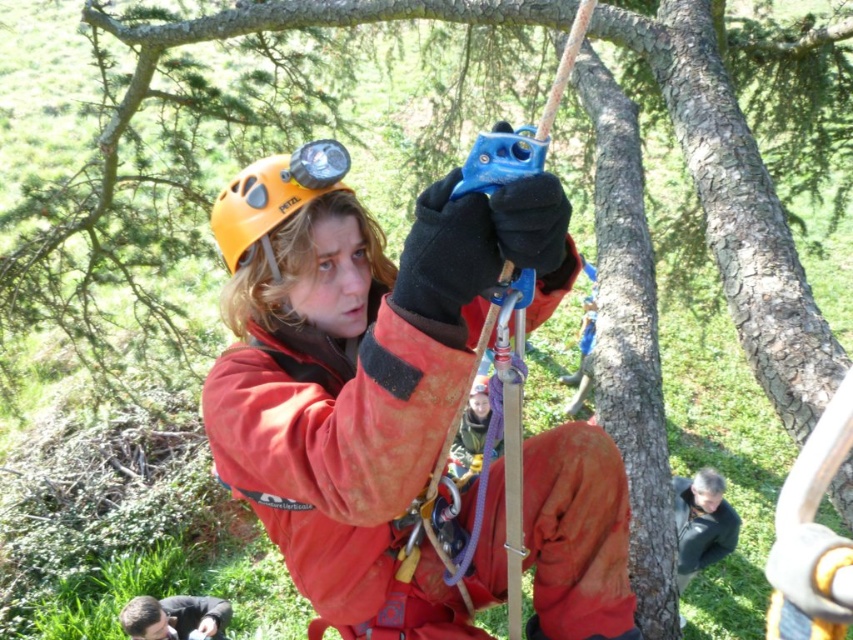
Question: Can you confirm if matte orange jacket at center is wider than dark green fabric at lower right?

Choices:
 (A) no
 (B) yes

Answer: (B)

Question: From the image, what is the correct spatial relationship of matte orange jacket at center in relation to yellow matte helmet at center?

Choices:
 (A) right
 (B) left

Answer: (A)

Question: Which of the following is the farthest from the observer?

Choices:
 (A) (676, 522)
 (B) (480, 461)
 (C) (381, 627)
 (D) (225, 605)

Answer: (A)

Question: Is dark brown leather jacket at lower left above matte yellow helmet at upper center?

Choices:
 (A) yes
 (B) no

Answer: (B)

Question: Which of the following is the farthest from the observer?

Choices:
 (A) (x=253, y=198)
 (B) (x=201, y=618)
 (C) (x=466, y=484)
 (D) (x=270, y=252)

Answer: (B)

Question: Which object is the closest to the matte orange jacket at center?

Choices:
 (A) matte yellow helmet at upper center
 (B) yellow matte helmet at center
 (C) dark green fabric at lower right
 (D) dark brown leather jacket at lower left

Answer: (B)